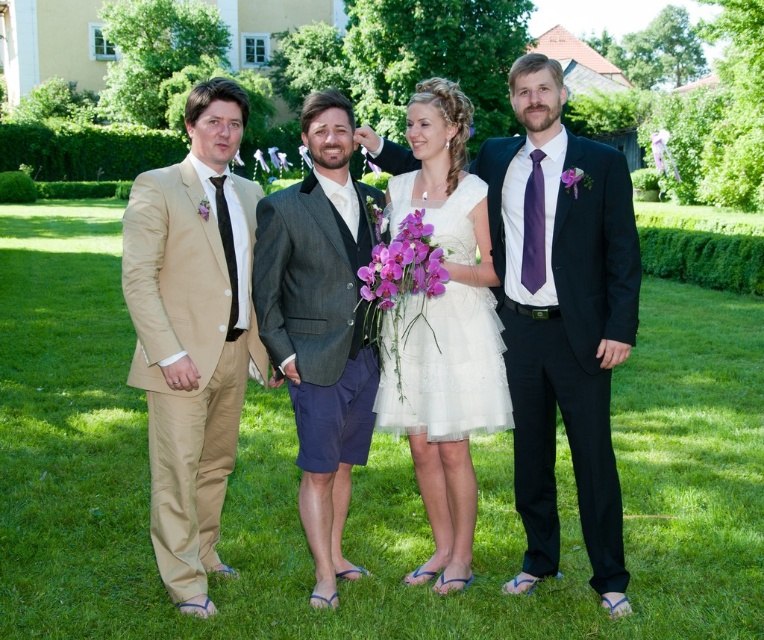
You are standing at the point marked by the coordinate (x=358, y=480) in the image. What is the immediate surface beneath your feet?

The immediate surface beneath your feet at point (x=358, y=480) is green grass at center.

You are a photographer trying to capture a clear shot of the white lace dress at center and the green grass at center. Which object is positioned lower in the frame?

The green grass at center is located below the white lace dress at center, so it is positioned lower in the frame.